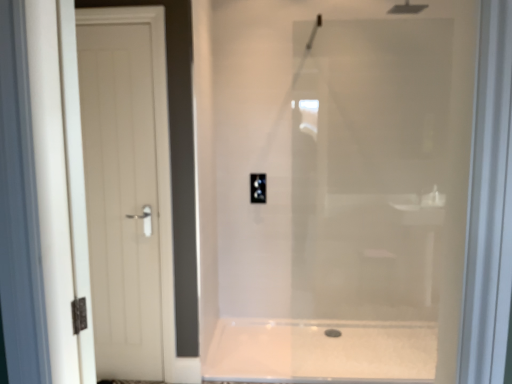
Question: Should I look upward or downward to see white matte door at left?

Choices:
 (A) up
 (B) down

Answer: (B)

Question: From a real-world perspective, is black plastic outlet at center beneath black rubber drain at lower center?

Choices:
 (A) no
 (B) yes

Answer: (A)

Question: Is black plastic outlet at center oriented towards black rubber drain at lower center?

Choices:
 (A) yes
 (B) no

Answer: (B)

Question: From a real-world perspective, is black plastic outlet at center located higher than black rubber drain at lower center?

Choices:
 (A) yes
 (B) no

Answer: (A)

Question: Is black plastic outlet at center positioned beyond the bounds of black rubber drain at lower center?

Choices:
 (A) no
 (B) yes

Answer: (B)

Question: Is the position of black plastic outlet at center less distant than that of black rubber drain at lower center?

Choices:
 (A) no
 (B) yes

Answer: (A)

Question: From the image's perspective, would you say black plastic outlet at center is positioned over black rubber drain at lower center?

Choices:
 (A) yes
 (B) no

Answer: (A)

Question: Does white matte door at left have a greater height compared to black rubber drain at lower center?

Choices:
 (A) no
 (B) yes

Answer: (B)

Question: Is black rubber drain at lower center at the back of white matte door at left?

Choices:
 (A) yes
 (B) no

Answer: (B)

Question: Would you say white matte door at left contains black rubber drain at lower center?

Choices:
 (A) no
 (B) yes

Answer: (A)

Question: From the image's perspective, is white matte door at left over black rubber drain at lower center?

Choices:
 (A) yes
 (B) no

Answer: (A)

Question: Considering the relative positions of white matte door at left and black rubber drain at lower center in the image provided, is white matte door at left to the right of black rubber drain at lower center from the viewer's perspective?

Choices:
 (A) no
 (B) yes

Answer: (A)

Question: Considering the relative sizes of white matte door at left and black rubber drain at lower center in the image provided, is white matte door at left bigger than black rubber drain at lower center?

Choices:
 (A) yes
 (B) no

Answer: (A)

Question: Considering the relative positions of white glossy bath at center and black plastic outlet at center in the image provided, is white glossy bath at center to the right of black plastic outlet at center from the viewer's perspective?

Choices:
 (A) no
 (B) yes

Answer: (B)